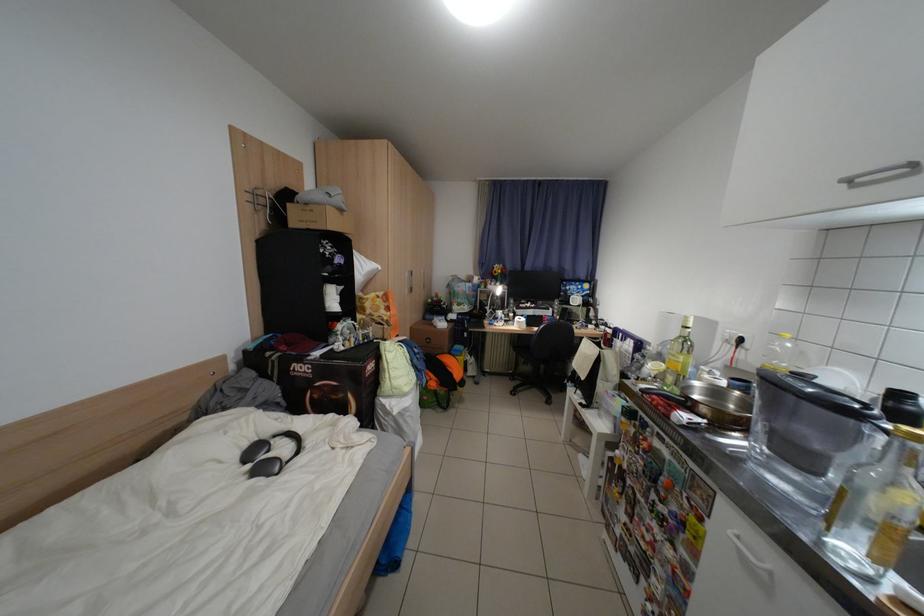
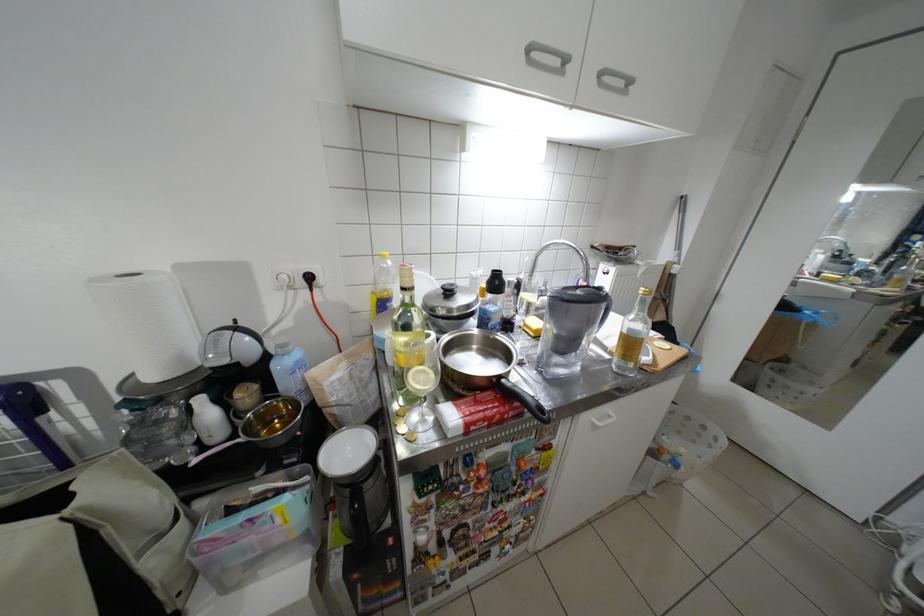
Locate, in the second image, the point that corresponds to the point at 801,346 in the first image.

(400, 264)